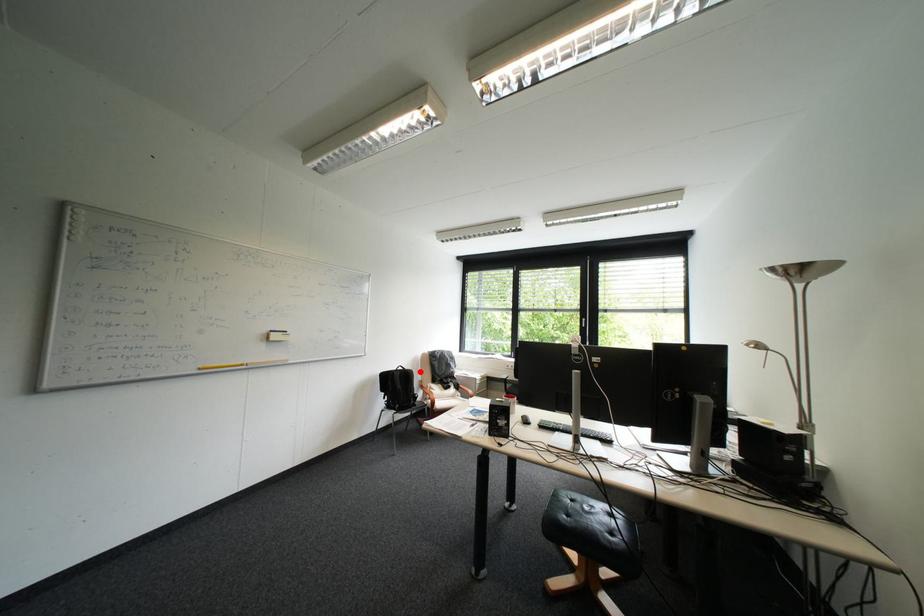
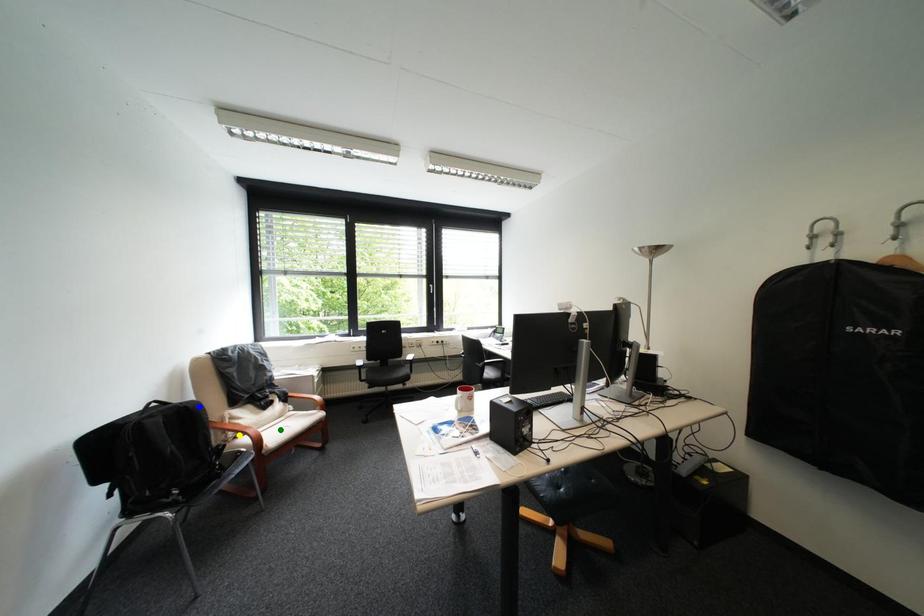
Question: I am providing you with two images of the same scene from different viewpoints. A red point is marked on the first image. You are given multiple points on the second image. Which point in image 2 is actually the same real-world point as the red point in image 1?

Choices:
 (A) yellow point
 (B) blue point
 (C) green point

Answer: (B)